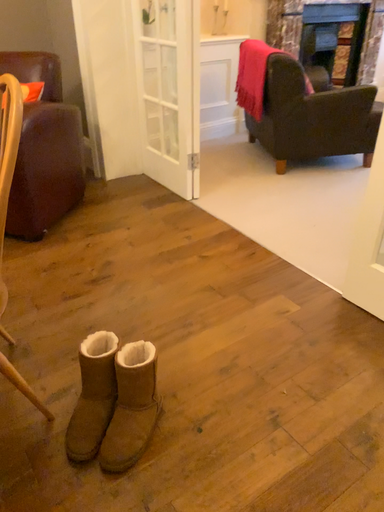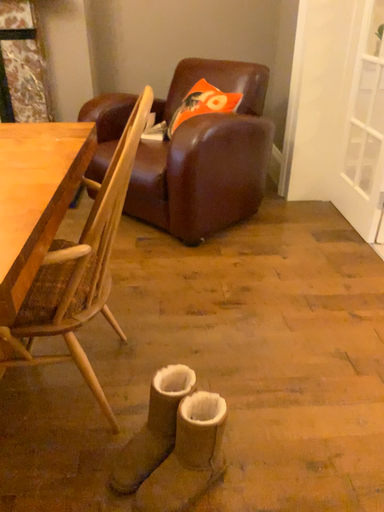
Question: How did the camera likely rotate when shooting the video?

Choices:
 (A) rotated right
 (B) rotated left

Answer: (B)